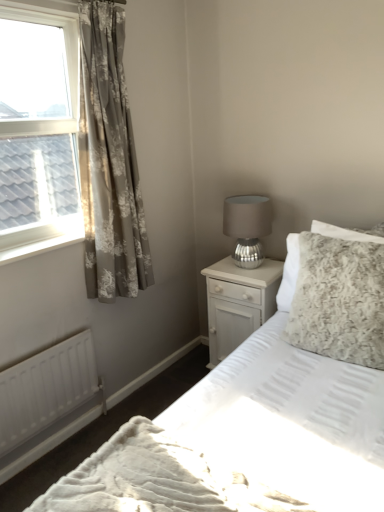
Question: Is white glossy nightstand at center-right located outside white textured bed at center?

Choices:
 (A) yes
 (B) no

Answer: (A)

Question: Is white glossy nightstand at center-right not near white textured bed at center?

Choices:
 (A) no
 (B) yes

Answer: (A)

Question: Does white glossy nightstand at center-right turn towards white textured bed at center?

Choices:
 (A) no
 (B) yes

Answer: (A)

Question: Is white glossy nightstand at center-right facing away from white textured bed at center?

Choices:
 (A) no
 (B) yes

Answer: (A)

Question: Does white glossy nightstand at center-right lie in front of white textured bed at center?

Choices:
 (A) yes
 (B) no

Answer: (B)

Question: Considering their positions, is clear glass window at upper left located in front of or behind fluffy white pillow at right?

Choices:
 (A) front
 (B) behind

Answer: (A)

Question: From the image's perspective, is clear glass window at upper left located above or below fluffy white pillow at right?

Choices:
 (A) below
 (B) above

Answer: (B)

Question: Is clear glass window at upper left to the left or to the right of fluffy white pillow at right in the image?

Choices:
 (A) left
 (B) right

Answer: (A)

Question: From a real-world perspective, is clear glass window at upper left positioned above or below fluffy white pillow at right?

Choices:
 (A) below
 (B) above

Answer: (B)

Question: Is fluffy white pillow at right inside the boundaries of floral-patterned fabric curtain at left, or outside?

Choices:
 (A) outside
 (B) inside

Answer: (A)

Question: Is fluffy white pillow at right in front of or behind floral-patterned fabric curtain at left in the image?

Choices:
 (A) behind
 (B) front

Answer: (B)

Question: Looking at their shapes, would you say fluffy white pillow at right is wider or thinner than floral-patterned fabric curtain at left?

Choices:
 (A) thin
 (B) wide

Answer: (B)

Question: Is fluffy white pillow at right bigger or smaller than floral-patterned fabric curtain at left?

Choices:
 (A) small
 (B) big

Answer: (A)

Question: Looking at the image, does clear glass window at upper left seem bigger or smaller compared to floral-patterned fabric curtain at left?

Choices:
 (A) small
 (B) big

Answer: (B)

Question: Is clear glass window at upper left inside or outside of floral-patterned fabric curtain at left?

Choices:
 (A) outside
 (B) inside

Answer: (A)